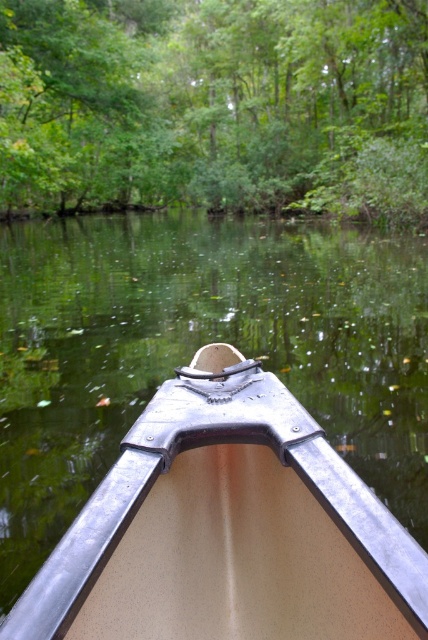
Does green leafy tree at upper center come behind metallic tan boat at center?

Yes.

Can you confirm if green leafy tree at upper center is taller than metallic tan boat at center?

Yes, green leafy tree at upper center is taller than metallic tan boat at center.

Which is behind, point (162, 10) or point (288, 476)?

The point (162, 10) is behind.

Locate an element on the screen. The image size is (428, 640). green leafy tree at upper center is located at coordinates (214, 106).